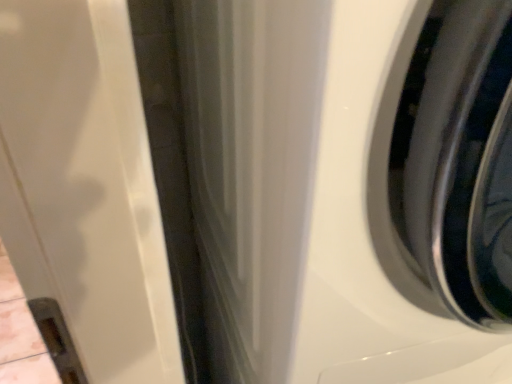
Question: Is metallic silver wheel at center right positioned before white glossy washing machine at right?

Choices:
 (A) no
 (B) yes

Answer: (A)

Question: From a real-world perspective, is metallic silver wheel at center right physically below white glossy washing machine at right?

Choices:
 (A) yes
 (B) no

Answer: (A)

Question: Is the surface of metallic silver wheel at center right in direct contact with white glossy washing machine at right?

Choices:
 (A) yes
 (B) no

Answer: (A)

Question: Is metallic silver wheel at center right positioned beyond the bounds of white glossy washing machine at right?

Choices:
 (A) yes
 (B) no

Answer: (A)

Question: Is metallic silver wheel at center right to the left of white glossy washing machine at right from the viewer's perspective?

Choices:
 (A) no
 (B) yes

Answer: (A)

Question: Can you confirm if metallic silver wheel at center right is shorter than white glossy washing machine at right?

Choices:
 (A) no
 (B) yes

Answer: (B)

Question: Is white glossy washing machine at right positioned with its back to metallic silver wheel at center right?

Choices:
 (A) yes
 (B) no

Answer: (B)

Question: From a real-world perspective, is white glossy washing machine at right physically above metallic silver wheel at center right?

Choices:
 (A) no
 (B) yes

Answer: (B)

Question: From the image's perspective, would you say white glossy washing machine at right is shown under metallic silver wheel at center right?

Choices:
 (A) yes
 (B) no

Answer: (A)

Question: Is white glossy washing machine at right positioned behind metallic silver wheel at center right?

Choices:
 (A) yes
 (B) no

Answer: (B)

Question: Does white glossy washing machine at right have a larger size compared to metallic silver wheel at center right?

Choices:
 (A) no
 (B) yes

Answer: (B)

Question: Does white glossy washing machine at right have a greater height compared to metallic silver wheel at center right?

Choices:
 (A) no
 (B) yes

Answer: (B)

Question: Is white glossy washing machine at right bigger or smaller than metallic silver wheel at center right?

Choices:
 (A) small
 (B) big

Answer: (B)